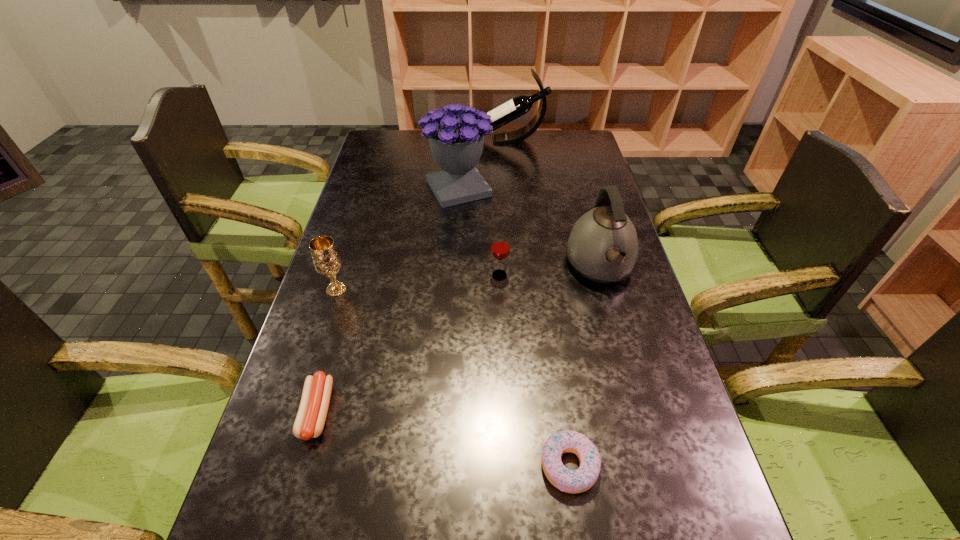
This screenshot has width=960, height=540. In order to click on the second farthest object in this screenshot , I will do `click(456, 142)`.

Image resolution: width=960 pixels, height=540 pixels. I want to click on wine bottle, so click(520, 105).

Where is `the fifth shortest object`? the fifth shortest object is located at coordinates (603, 246).

In order to click on the fourth tallest object in this screenshot , I will do `click(326, 259)`.

The image size is (960, 540). In order to click on the third shortest object in this screenshot , I will do click(500, 248).

Identify the location of doughnut. (573, 481).

Where is `sausage`? sausage is located at coordinates (310, 420).

Locate an element on the screen. free spot located 0.190m on the front of the second farthest object is located at coordinates pos(454,248).

At what (x,y) coordinates should I click in order to perform the action: click on vacant space located 0.360m on the stand of the wine bottle. Please return your answer as a coordinate pair (x, y). The image size is (960, 540). Looking at the image, I should click on (383, 140).

Where is `vacant region located on the stand of the wine bottle`? The height and width of the screenshot is (540, 960). vacant region located on the stand of the wine bottle is located at coordinates (398, 140).